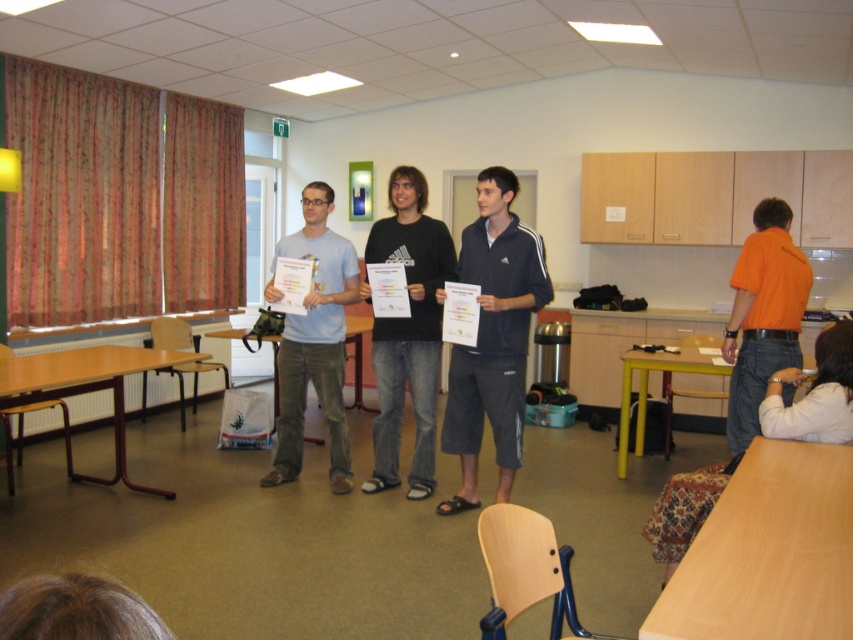
Is dark blue athletic shorts at center to the right of matte light blue t-shirt at center from the viewer's perspective?

Correct, you'll find dark blue athletic shorts at center to the right of matte light blue t-shirt at center.

Between dark blue athletic shorts at center and matte light blue t-shirt at center, which one has less height?

matte light blue t-shirt at center

The width and height of the screenshot is (853, 640). In order to click on dark blue athletic shorts at center in this screenshot , I will do `click(492, 337)`.

Does dark blue athletic shorts at center appear on the right side of orange cotton shirt at right?

In fact, dark blue athletic shorts at center is to the left of orange cotton shirt at right.

The image size is (853, 640). What do you see at coordinates (492, 337) in the screenshot?
I see `dark blue athletic shorts at center` at bounding box center [492, 337].

At what (x,y) coordinates should I click in order to perform the action: click on dark blue athletic shorts at center. Please return your answer as a coordinate pair (x, y). The image size is (853, 640). Looking at the image, I should click on (492, 337).

Which of these two, black cotton shirt at center or matte light blue t-shirt at center, stands taller?

black cotton shirt at center

Is black cotton shirt at center positioned at the back of matte light blue t-shirt at center?

That is False.

Is point (431, 301) behind point (277, 358)?

No, (431, 301) is closer to viewer.

At what (x,y) coordinates should I click in order to perform the action: click on black cotton shirt at center. Please return your answer as a coordinate pair (x, y). Looking at the image, I should click on (408, 332).